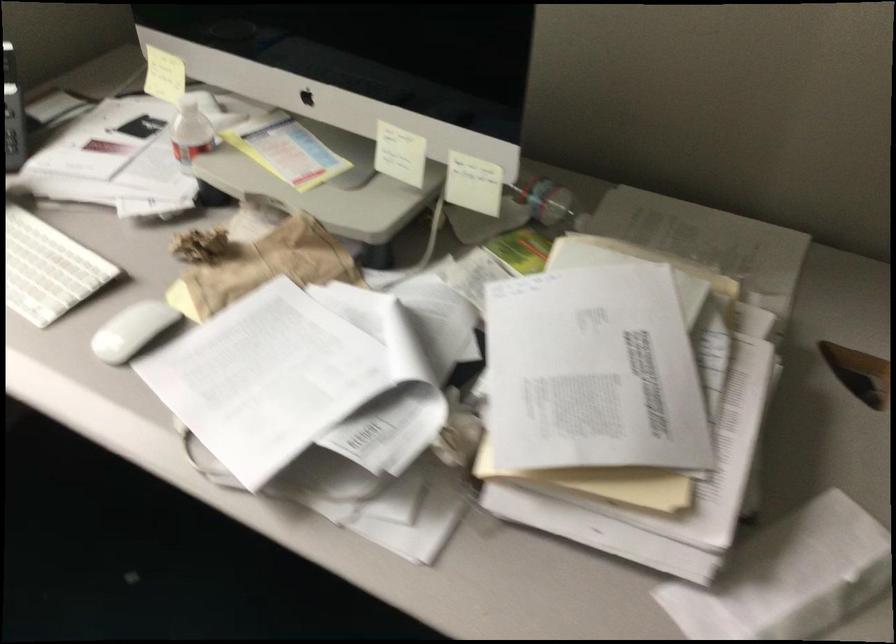
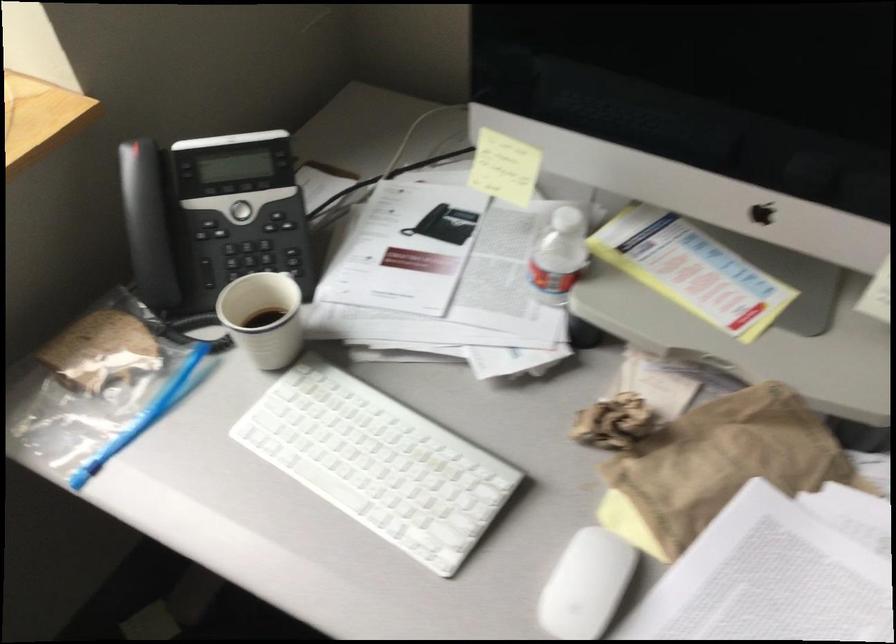
The point at [263,272] is marked in the first image. Where is the corresponding point in the second image?

(718, 466)